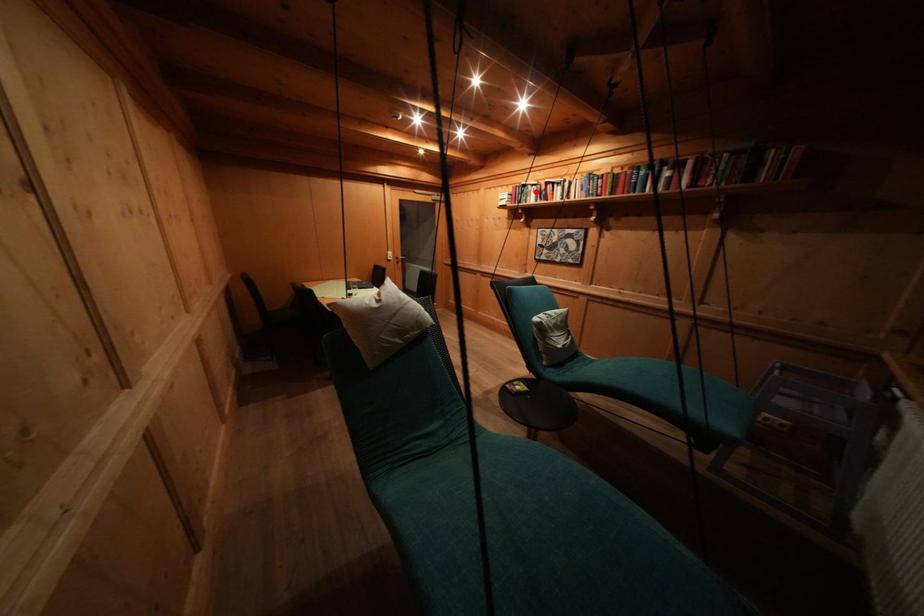
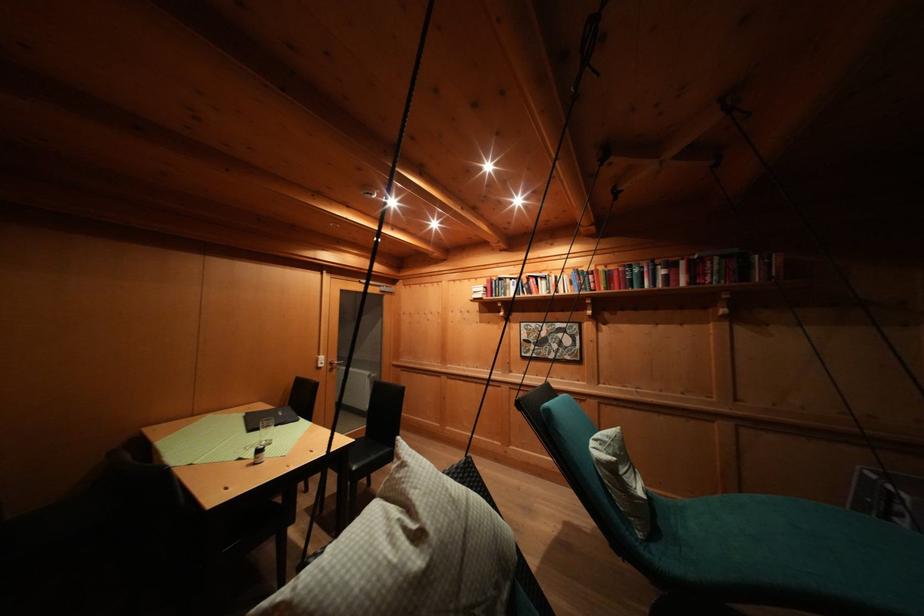
Question: A red point is marked in image1. In image2, is the corresponding 3D point closer to the camera or farther? Reply with the corresponding letter.

Choices:
 (A) The corresponding 3D point is closer.
 (B) The corresponding 3D point is farther.

Answer: (B)